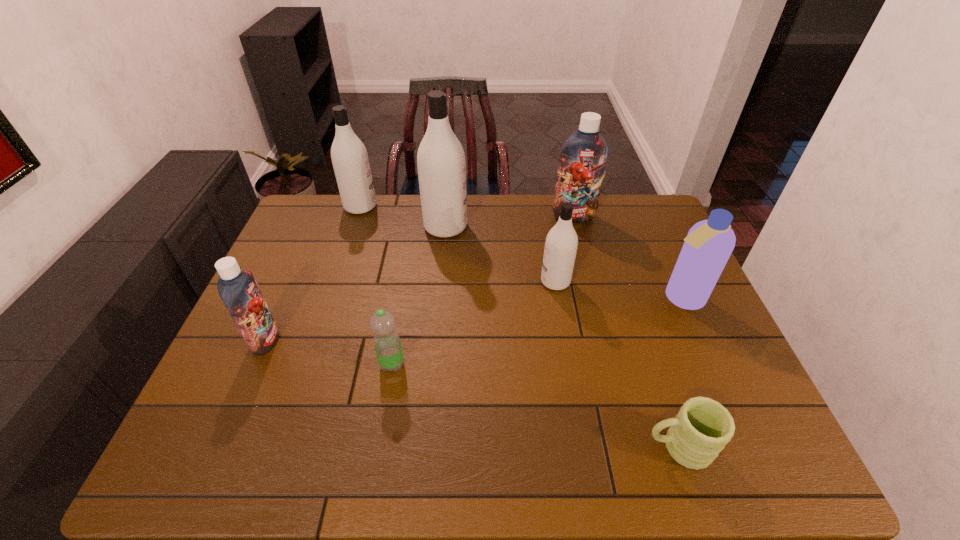
The height and width of the screenshot is (540, 960). I want to click on the biggest white shampoo, so click(x=441, y=163).

I want to click on the second white shampoo from right to left, so click(x=441, y=163).

Locate an element on the screen. The height and width of the screenshot is (540, 960). the seventh object from right to left is located at coordinates (349, 156).

You are a GUI agent. You are given a task and a screenshot of the screen. Output one action in this format:
    pyautogui.click(x=<x>, y=<y>)
    Task: Click on the second shampoo from left to right
    Image resolution: width=960 pixels, height=540 pixels.
    Given the screenshot: What is the action you would take?
    pyautogui.click(x=349, y=156)

At what (x,y) coordinates should I click in order to perform the action: click on the right blue shampoo. Please return your answer as a coordinate pair (x, y). Looking at the image, I should click on (583, 156).

This screenshot has height=540, width=960. I want to click on the bigger blue shampoo, so click(x=583, y=156).

Find the location of a particular element. the rightmost object is located at coordinates (709, 243).

Identify the location of the nearer blue shampoo. This screenshot has width=960, height=540. (238, 289).

Locate an element on the screen. the nearest shampoo is located at coordinates (238, 289).

I want to click on the rightmost white shampoo, so click(561, 243).